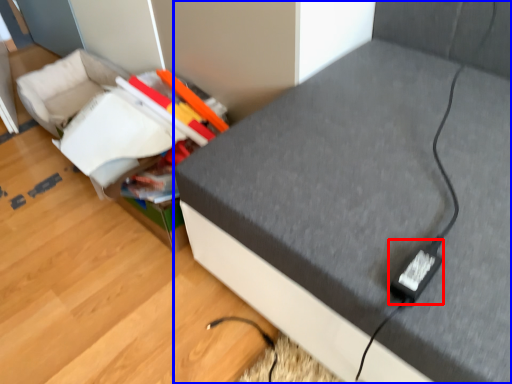
Question: Which object is further to the camera taking this photo, plug (highlighted by a red box) or furniture (highlighted by a blue box)?

Choices:
 (A) plug
 (B) furniture

Answer: (A)